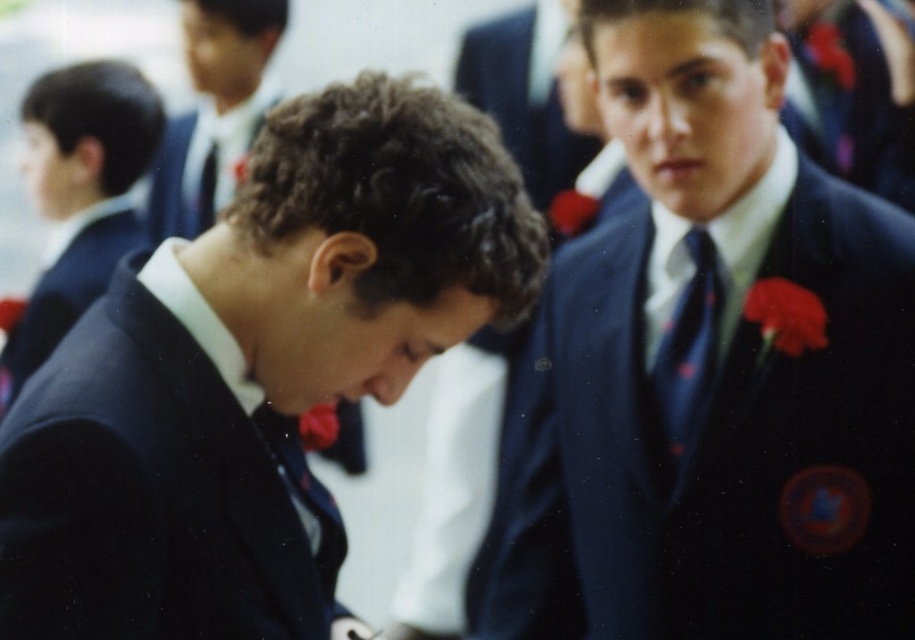
Question: Can you confirm if navy blue suit at lower left is positioned above matte black suit at left?

Choices:
 (A) no
 (B) yes

Answer: (A)

Question: Among these objects, which one is nearest to the camera?

Choices:
 (A) matte blue tie at center
 (B) matte black suit at center

Answer: (B)

Question: Which of the following is the closest to the observer?

Choices:
 (A) (142, 296)
 (B) (198, 230)
 (C) (670, 163)
 (D) (233, 140)

Answer: (A)

Question: Can you confirm if matte blue suit at center is bigger than matte black suit at left?

Choices:
 (A) no
 (B) yes

Answer: (B)

Question: Which of the following is the farthest from the observer?

Choices:
 (A) matte black suit at center
 (B) matte blue tie at center-right
 (C) navy blue suit at lower left
 (D) matte black suit at upper left

Answer: (D)

Question: Can you confirm if matte black suit at left is thinner than matte black suit at upper left?

Choices:
 (A) no
 (B) yes

Answer: (B)